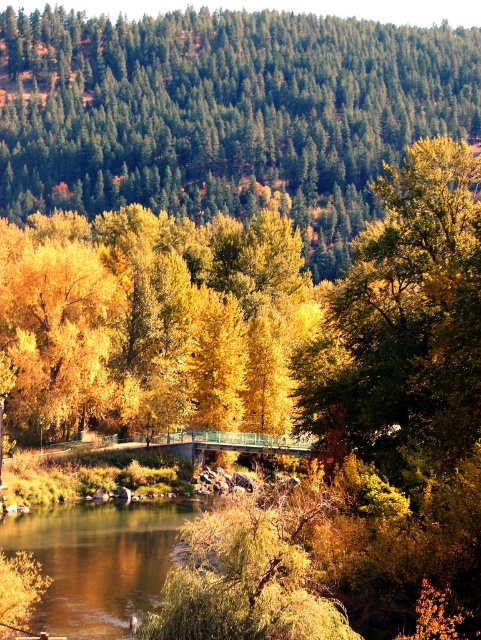
You are an artist planning to paint this autumn landscape. You want to ensure the yellow matte tree at upper center and the brown smooth river at center are proportionally accurate. Which object should you make taller in your painting?

The yellow matte tree at upper center should be depicted as taller in the painting since it is taller than the brown smooth river at center according to the description.

You are a photographer planning to take a landscape photo of the yellow matte tree at upper center and the brown smooth river at center. Which object will appear bigger in the photo?

The yellow matte tree at upper center will appear bigger in the photo because it has a larger size compared to the brown smooth river at center.